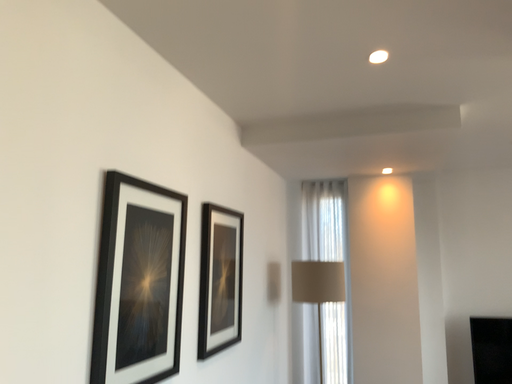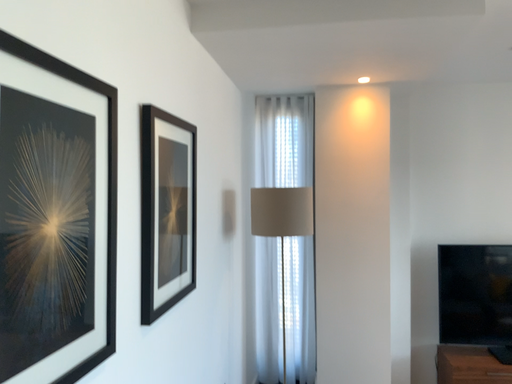
Question: How did the camera likely rotate when shooting the video?

Choices:
 (A) rotated upward
 (B) rotated downward

Answer: (B)